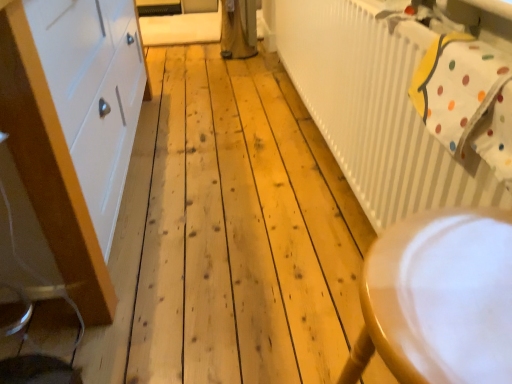
The height and width of the screenshot is (384, 512). What are the coordinates of `wooden chair at lower right` in the screenshot? It's located at (439, 299).

The width and height of the screenshot is (512, 384). I want to click on white ribbed radiator at upper right, so click(x=376, y=110).

I want to click on white polka dot fabric at upper right, so click(x=466, y=99).

Is white painted wood cabinet at left far away from white ribbed radiator at upper right?

No, there isn't a large distance between white painted wood cabinet at left and white ribbed radiator at upper right.

From a real-world perspective, is white painted wood cabinet at left physically above white ribbed radiator at upper right?

Yes.

Find the location of a particular element. cabinetry on the left of white ribbed radiator at upper right is located at coordinates (74, 127).

From the image's perspective, is white painted wood cabinet at left located above white ribbed radiator at upper right?

No.

From their relative heights in the image, would you say white ribbed radiator at upper right is taller or shorter than wooden chair at lower right?

Considering their sizes, white ribbed radiator at upper right has more height than wooden chair at lower right.

This screenshot has height=384, width=512. I want to click on radiator on the right of wooden chair at lower right, so click(376, 110).

From the image's perspective, does white ribbed radiator at upper right appear lower than wooden chair at lower right?

No, from the image's perspective, white ribbed radiator at upper right is not below wooden chair at lower right.

Is white ribbed radiator at upper right bigger than wooden chair at lower right?

Correct, white ribbed radiator at upper right is larger in size than wooden chair at lower right.

Is the depth of white polka dot fabric at upper right less than that of white ribbed radiator at upper right?

No, it is not.

From the image's perspective, is white polka dot fabric at upper right over white ribbed radiator at upper right?

No, from the image's perspective, white polka dot fabric at upper right is not above white ribbed radiator at upper right.

Considering the positions of objects white polka dot fabric at upper right and white ribbed radiator at upper right in the image provided, who is more to the left, white polka dot fabric at upper right or white ribbed radiator at upper right?

From the viewer's perspective, white ribbed radiator at upper right appears more on the left side.

Could you tell me if wooden chair at lower right is facing white painted wood cabinet at left?

No, wooden chair at lower right is not oriented towards white painted wood cabinet at left.

Between point (440, 230) and point (92, 258), which one is positioned behind?

The point (92, 258) is behind.

Which of these two, wooden chair at lower right or white painted wood cabinet at left, is smaller?

wooden chair at lower right is smaller.

Would you say white painted wood cabinet at left is a long distance from wooden chair at lower right?

Yes, white painted wood cabinet at left is far from wooden chair at lower right.

Identify the location of furniture directly beneath the white painted wood cabinet at left (from a real-world perspective). This screenshot has height=384, width=512. (439, 299).

Considering the positions of objects white painted wood cabinet at left and wooden chair at lower right in the image provided, who is more to the right, white painted wood cabinet at left or wooden chair at lower right?

wooden chair at lower right is more to the right.

How different are the orientations of white painted wood cabinet at left and wooden chair at lower right in degrees?

The angle between the facing direction of white painted wood cabinet at left and the facing direction of wooden chair at lower right is 0.822 degrees.

What's the angular difference between white ribbed radiator at upper right and white painted wood cabinet at left's facing directions?

The angular difference between white ribbed radiator at upper right and white painted wood cabinet at left is 0.203 degrees.

Between white ribbed radiator at upper right and white painted wood cabinet at left, which one appears on the right side from the viewer's perspective?

white ribbed radiator at upper right.

Is white ribbed radiator at upper right positioned with its back to white painted wood cabinet at left?

That's right, white ribbed radiator at upper right is facing away from white painted wood cabinet at left.

Between point (278, 53) and point (75, 57), which one is positioned in front?

The point (75, 57) is more forward.

Is wooden chair at lower right oriented away from white polka dot fabric at upper right?

No, wooden chair at lower right's orientation is not away from white polka dot fabric at upper right.

From the picture: Is wooden chair at lower right not inside white polka dot fabric at upper right?

wooden chair at lower right is positioned outside white polka dot fabric at upper right.

Find the location of `radiator that is above the white painted wood cabinet at left (from the image's perspective)`. radiator that is above the white painted wood cabinet at left (from the image's perspective) is located at coordinates click(376, 110).

Locate an element on the screen. This screenshot has width=512, height=384. furniture that is on the left side of white ribbed radiator at upper right is located at coordinates (439, 299).

When comparing their distances from white painted wood cabinet at left, does wooden chair at lower right or white ribbed radiator at upper right seem further?

The object further to white painted wood cabinet at left is wooden chair at lower right.

Looking at the image, which one is located closer to white painted wood cabinet at left, wooden chair at lower right or white polka dot fabric at upper right?

white polka dot fabric at upper right.

Based on the photo, when comparing their distances from wooden chair at lower right, does white painted wood cabinet at left or white ribbed radiator at upper right seem closer?

white ribbed radiator at upper right.

Considering their positions, is white ribbed radiator at upper right positioned closer to wooden chair at lower right than white painted wood cabinet at left?

white ribbed radiator at upper right is closer to wooden chair at lower right.

When comparing their distances from wooden chair at lower right, does white painted wood cabinet at left or white polka dot fabric at upper right seem further?

white painted wood cabinet at left is positioned further to the anchor wooden chair at lower right.

Based on the photo, estimate the real-world distances between objects in this image. Which object is closer to white polka dot fabric at upper right, white painted wood cabinet at left or wooden chair at lower right?

Among the two, wooden chair at lower right is located nearer to white polka dot fabric at upper right.

Looking at the image, which one is located closer to white painted wood cabinet at left, white ribbed radiator at upper right or white polka dot fabric at upper right?

white ribbed radiator at upper right lies closer to white painted wood cabinet at left than the other object.

Based on their spatial positions, is white painted wood cabinet at left or white ribbed radiator at upper right closer to white polka dot fabric at upper right?

The object closer to white polka dot fabric at upper right is white ribbed radiator at upper right.

Where is `furniture between white painted wood cabinet at left and white polka dot fabric at upper right from left to right`? This screenshot has width=512, height=384. furniture between white painted wood cabinet at left and white polka dot fabric at upper right from left to right is located at coordinates (439, 299).

Find the location of a particular element. laundry between white ribbed radiator at upper right and wooden chair at lower right in the up-down direction is located at coordinates point(466,99).

The height and width of the screenshot is (384, 512). What are the coordinates of `furniture between white painted wood cabinet at left and white ribbed radiator at upper right from left to right` in the screenshot? It's located at (439, 299).

Identify the location of radiator situated between white painted wood cabinet at left and white polka dot fabric at upper right from left to right. (376, 110).